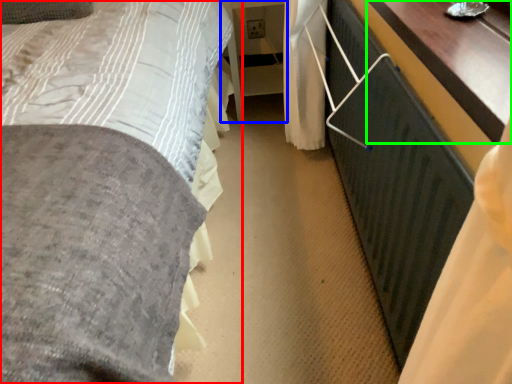
Question: Which object is positioned closest to bed (highlighted by a red box)? Select from table (highlighted by a blue box) and table (highlighted by a green box).

Choices:
 (A) table
 (B) table

Answer: (B)